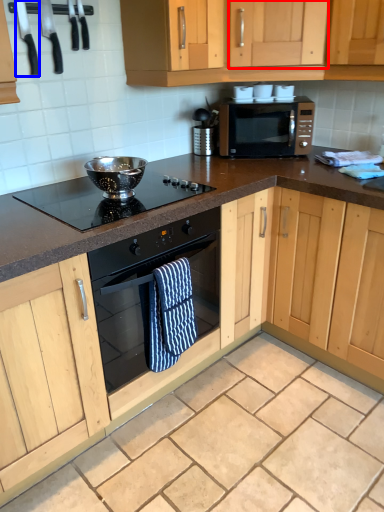
Question: Which object is further to the camera taking this photo, cabinetry (highlighted by a red box) or appliance (highlighted by a blue box)?

Choices:
 (A) cabinetry
 (B) appliance

Answer: (A)